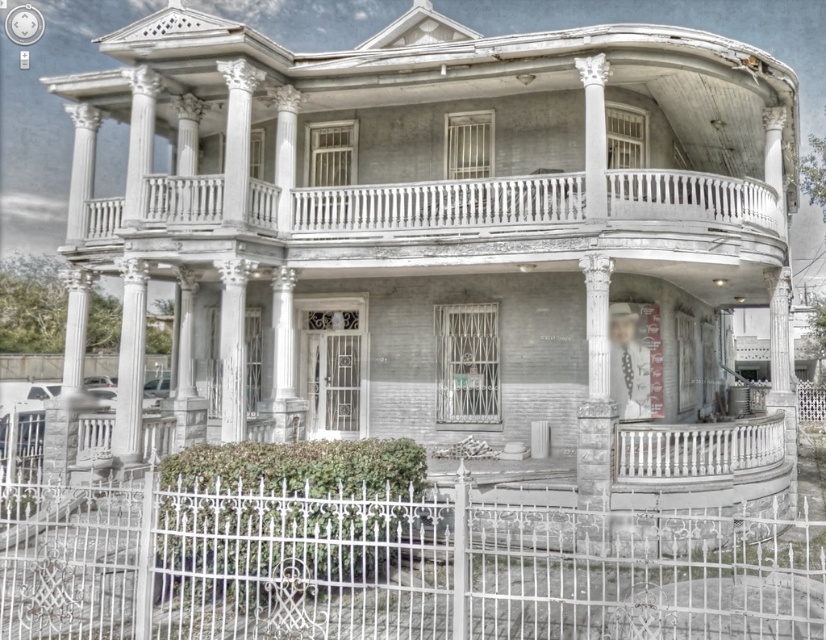
Between white wrought iron fence at lower center and white wood balustrade at lower right, which one is positioned lower?

white wrought iron fence at lower center is lower down.

Which of these two, white wrought iron fence at lower center or white wood balustrade at lower right, stands taller?

Standing taller between the two is white wood balustrade at lower right.

Is point (635, 618) closer to viewer compared to point (625, 465)?

Yes, it is in front of point (625, 465).

I want to click on white wrought iron fence at lower center, so click(x=392, y=566).